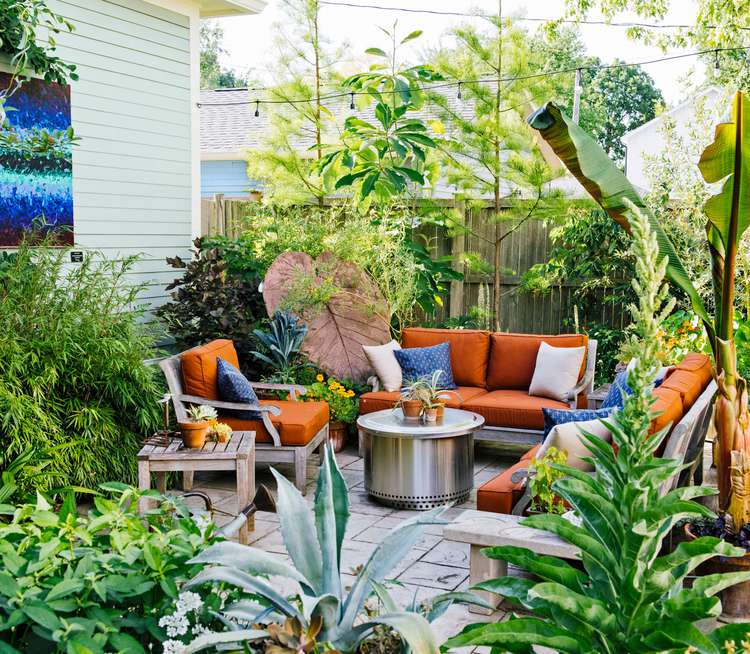
Locate an element on the screen. The width and height of the screenshot is (750, 654). grey wooden couch is located at coordinates (504, 530).